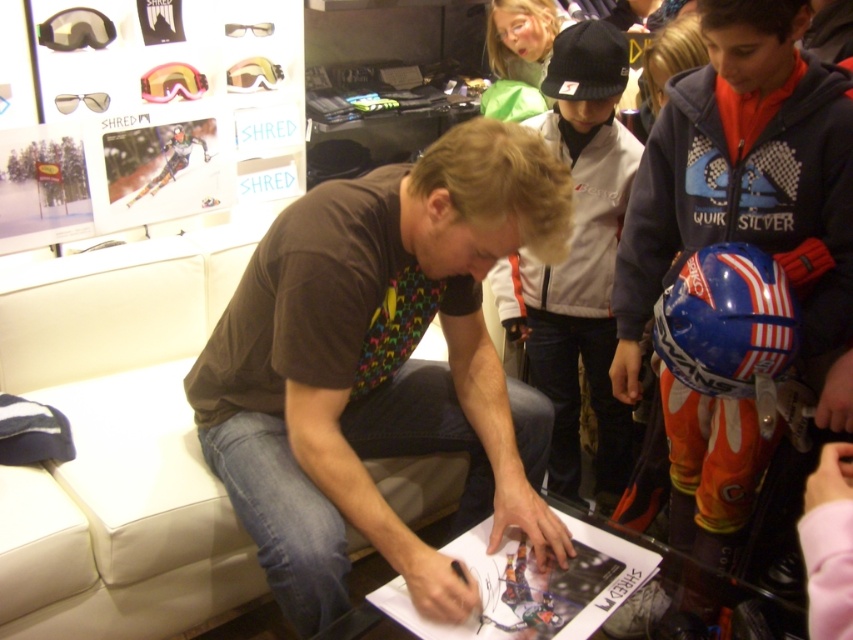
Question: Can you confirm if brownmaterial shirt at center is bigger than black glossy pen at center?

Choices:
 (A) yes
 (B) no

Answer: (A)

Question: Estimate the real-world distances between objects in this image. Which object is closer to the black glossy pen at center?

Choices:
 (A) brownmaterial shirt at center
 (B) matte black poster at upper left

Answer: (A)

Question: Can you confirm if matte black poster at upper left is positioned to the left of white paper at center?

Choices:
 (A) yes
 (B) no

Answer: (A)

Question: Which object appears farthest from the camera in this image?

Choices:
 (A) brownmaterial shirt at center
 (B) white paper at center

Answer: (B)

Question: Which point appears closest to the camera in this image?

Choices:
 (A) (607, 611)
 (B) (538, 516)
 (C) (222, 515)

Answer: (A)

Question: Can you confirm if matte black poster at upper left is wider than black glossy pen at center?

Choices:
 (A) yes
 (B) no

Answer: (A)